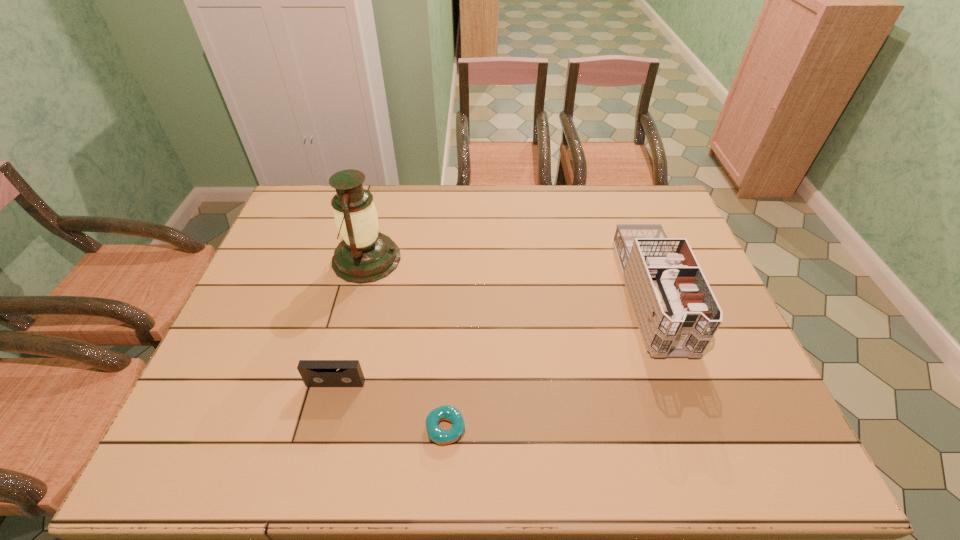
Locate an element on the screen. vacant space in between the rightmost object and the second shortest object is located at coordinates (493, 339).

At what (x,y) coordinates should I click in order to perform the action: click on free spot between the tallest object and the videotape. Please return your answer as a coordinate pair (x, y). Image resolution: width=960 pixels, height=540 pixels. Looking at the image, I should click on (351, 321).

Image resolution: width=960 pixels, height=540 pixels. In order to click on vacant area that lies between the third tallest object and the dollhouse in this screenshot , I will do `click(493, 339)`.

Find the location of a particular element. This screenshot has height=540, width=960. vacant area that lies between the third object from left to right and the second tallest object is located at coordinates (548, 361).

Image resolution: width=960 pixels, height=540 pixels. I want to click on vacant point located between the rightmost object and the third object from left to right, so click(x=548, y=361).

At what (x,y) coordinates should I click in order to perform the action: click on blank region between the lantern and the dollhouse. Please return your answer as a coordinate pair (x, y). This screenshot has width=960, height=540. Looking at the image, I should click on (509, 277).

In order to click on free space between the rightmost object and the third tallest object in this screenshot , I will do `click(493, 339)`.

This screenshot has height=540, width=960. In order to click on free point between the third shortest object and the second shortest object in this screenshot , I will do `click(493, 339)`.

Find the location of a particular element. vacant space that is in between the doughnut and the third shortest object is located at coordinates (548, 361).

Point out which object is positioned as the second nearest to the nearest object. Please provide its 2D coordinates. Your answer should be formatted as a tuple, i.e. [(x, y)], where the tuple contains the x and y coordinates of a point satisfying the conditions above.

[(365, 255)]